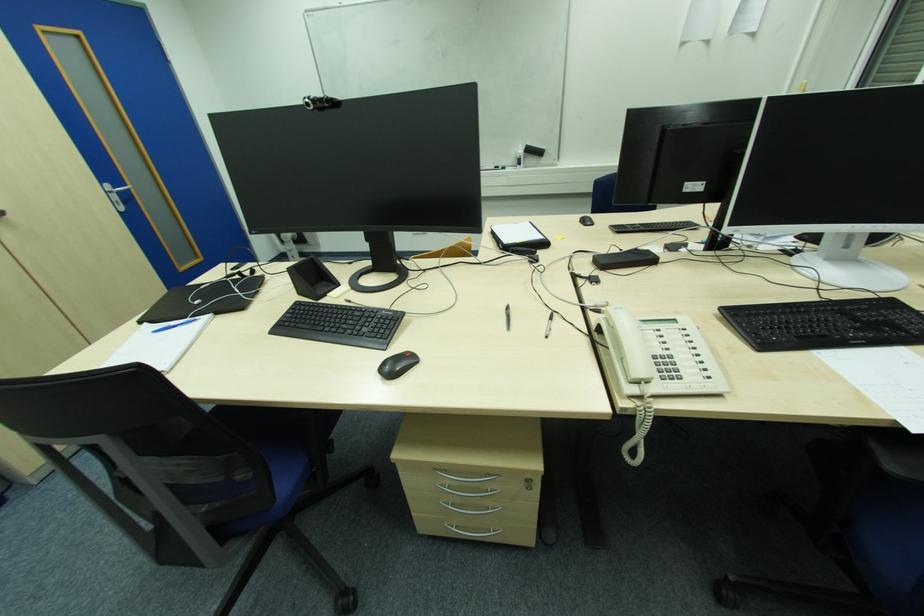
Find where to lift the telephone handset. Please return your answer as a coordinate pair (x, y).

(657, 363)